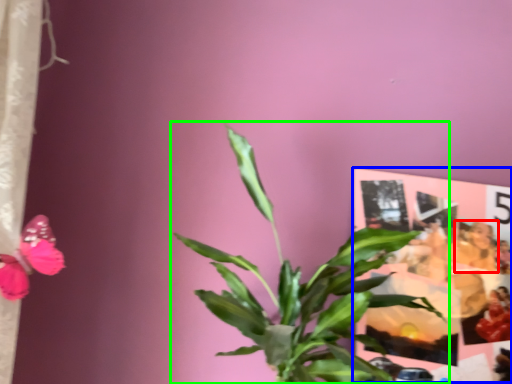
Question: Which is nearer to the person (highlighted by a red box)? postcard (highlighted by a blue box) or houseplant (highlighted by a green box).

Choices:
 (A) postcard
 (B) houseplant

Answer: (A)